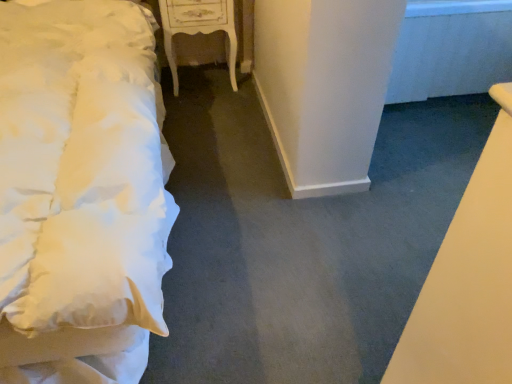
Question: Is white glossy nightstand at center to the left or to the right of white soft bed at left in the image?

Choices:
 (A) right
 (B) left

Answer: (A)

Question: In terms of height, does white glossy nightstand at center look taller or shorter compared to white soft bed at left?

Choices:
 (A) short
 (B) tall

Answer: (A)

Question: From the image's perspective, is white glossy nightstand at center positioned above or below white soft bed at left?

Choices:
 (A) above
 (B) below

Answer: (A)

Question: From their relative heights in the image, would you say white soft bed at left is taller or shorter than white glossy nightstand at center?

Choices:
 (A) short
 (B) tall

Answer: (B)

Question: Considering the positions of point [136, 243] and point [173, 4], is point [136, 243] closer or farther from the camera than point [173, 4]?

Choices:
 (A) farther
 (B) closer

Answer: (B)

Question: From a real-world perspective, relative to white glossy nightstand at center, is white soft bed at left vertically above or below?

Choices:
 (A) above
 (B) below

Answer: (A)

Question: Which is correct: white soft bed at left is inside white glossy nightstand at center, or outside of it?

Choices:
 (A) inside
 (B) outside

Answer: (B)